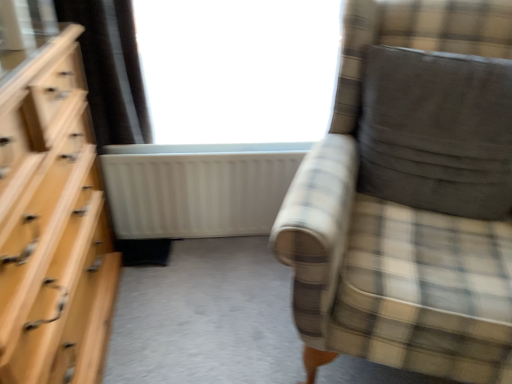
Question: Is dark gray suede pillow at right taller than transparent glass window at upper center?

Choices:
 (A) yes
 (B) no

Answer: (B)

Question: Is dark gray suede pillow at right directly adjacent to transparent glass window at upper center?

Choices:
 (A) yes
 (B) no

Answer: (B)

Question: From the image's perspective, is dark gray suede pillow at right located beneath transparent glass window at upper center?

Choices:
 (A) no
 (B) yes

Answer: (B)

Question: Does dark gray suede pillow at right have a lesser width compared to transparent glass window at upper center?

Choices:
 (A) no
 (B) yes

Answer: (A)

Question: Is dark gray suede pillow at right closer to the viewer compared to transparent glass window at upper center?

Choices:
 (A) yes
 (B) no

Answer: (A)

Question: Based on their sizes in the image, would you say white matte radiator at center is bigger or smaller than light wood dresser at left?

Choices:
 (A) big
 (B) small

Answer: (B)

Question: From the image's perspective, is white matte radiator at center located above or below light wood dresser at left?

Choices:
 (A) below
 (B) above

Answer: (B)

Question: Looking at their shapes, would you say white matte radiator at center is wider or thinner than light wood dresser at left?

Choices:
 (A) thin
 (B) wide

Answer: (A)

Question: Is white matte radiator at center in front of or behind light wood dresser at left in the image?

Choices:
 (A) front
 (B) behind

Answer: (B)

Question: Is point (334, 72) closer or farther from the camera than point (473, 311)?

Choices:
 (A) farther
 (B) closer

Answer: (A)

Question: Relative to plaid fabric chair at right, is transparent glass window at upper center in front or behind?

Choices:
 (A) behind
 (B) front

Answer: (A)

Question: Choose the correct answer: Is transparent glass window at upper center inside plaid fabric chair at right or outside it?

Choices:
 (A) outside
 (B) inside

Answer: (A)

Question: Considering the positions of transparent glass window at upper center and plaid fabric chair at right in the image, is transparent glass window at upper center taller or shorter than plaid fabric chair at right?

Choices:
 (A) short
 (B) tall

Answer: (A)

Question: From the image's perspective, is white matte radiator at center positioned above or below plaid fabric chair at right?

Choices:
 (A) above
 (B) below

Answer: (A)

Question: In terms of size, does white matte radiator at center appear bigger or smaller than plaid fabric chair at right?

Choices:
 (A) small
 (B) big

Answer: (A)